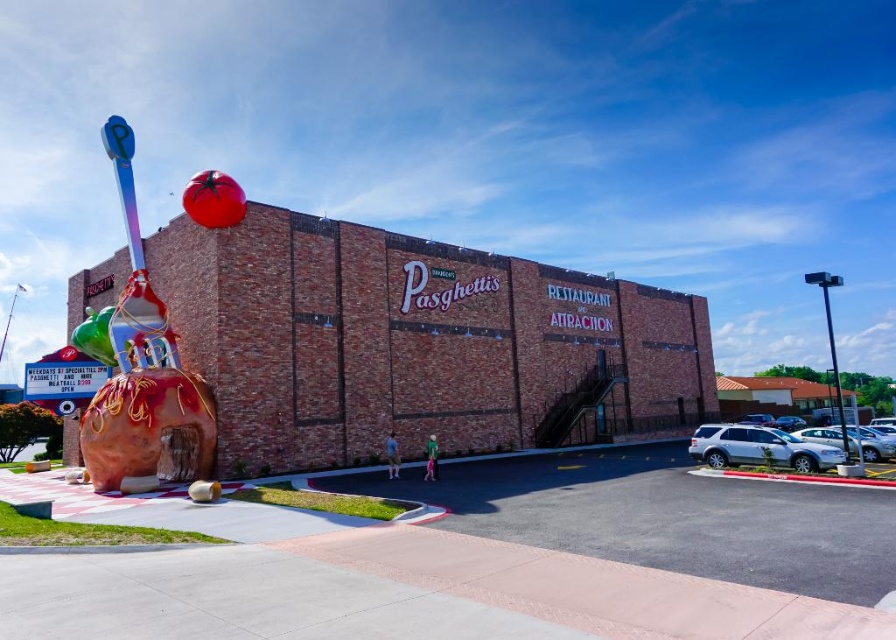
Does shiny metallic spoon at left have a larger size compared to metallic pole at right?

No, shiny metallic spoon at left is not bigger than metallic pole at right.

You are a GUI agent. You are given a task and a screenshot of the screen. Output one action in this format:
    pyautogui.click(x=<x>, y=<y>)
    Task: Click on the shiny metallic spoon at left
    
    Given the screenshot: What is the action you would take?
    pyautogui.click(x=143, y=372)

This screenshot has width=896, height=640. What do you see at coordinates (143, 372) in the screenshot?
I see `shiny metallic spoon at left` at bounding box center [143, 372].

I want to click on shiny metallic spoon at left, so click(x=143, y=372).

Can you confirm if brick building at center is bigger than black metal pole at right?

No, brick building at center is not bigger than black metal pole at right.

Does brick building at center have a smaller size compared to black metal pole at right?

Indeed, brick building at center has a smaller size compared to black metal pole at right.

Is point (489, 307) closer to viewer compared to point (830, 348)?

Yes, point (489, 307) is closer to viewer.

Identify the location of brick building at center. (416, 342).

Which is more to the left, shiny metallic spoon at left or black metal pole at right?

shiny metallic spoon at left is more to the left.

Is shiny metallic spoon at left wider than black metal pole at right?

Incorrect, shiny metallic spoon at left's width does not surpass black metal pole at right's.

Does point (83, 451) come behind point (825, 300)?

No.

Identify the location of shiny metallic spoon at left. (143, 372).